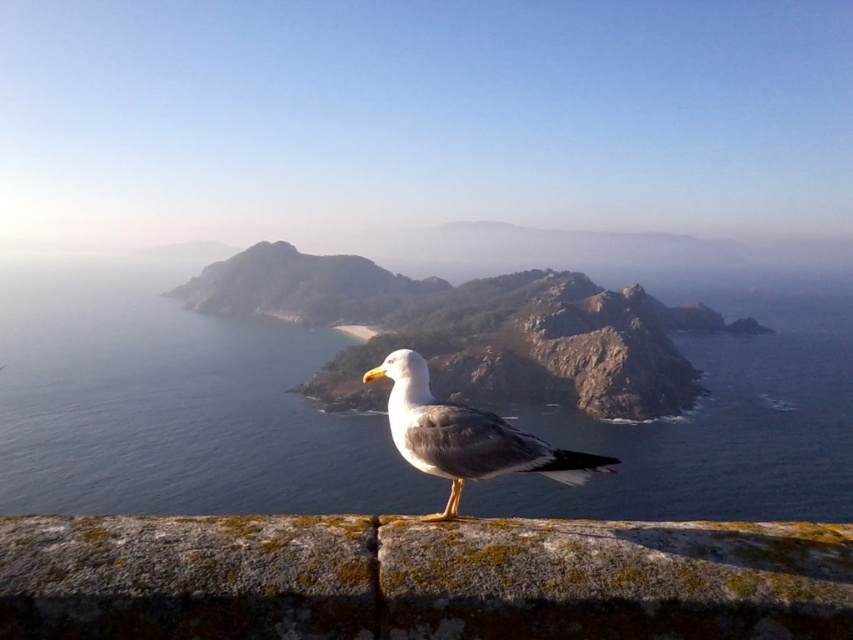
Can you confirm if blue water at center is taller than gray feathered seagull at center?

Correct, blue water at center is much taller as gray feathered seagull at center.

Between blue water at center and gray feathered seagull at center, which one appears on the left side from the viewer's perspective?

gray feathered seagull at center

Image resolution: width=853 pixels, height=640 pixels. What do you see at coordinates (173, 403) in the screenshot?
I see `blue water at center` at bounding box center [173, 403].

At what (x,y) coordinates should I click in order to perform the action: click on blue water at center. Please return your answer as a coordinate pair (x, y). Looking at the image, I should click on (173, 403).

This screenshot has height=640, width=853. In order to click on blue water at center in this screenshot , I will do `click(173, 403)`.

Can you confirm if blue water at center is thinner than mossy stone at center?

No, blue water at center is not thinner than mossy stone at center.

Who is more distant from viewer, (415, 483) or (138, 529)?

Positioned behind is point (415, 483).

Locate an element on the screen. blue water at center is located at coordinates (173, 403).

Is mossy stone at center shorter than gray feathered seagull at center?

Yes.

Who is more forward, (834,595) or (483,444)?

Point (834,595) is in front.

The height and width of the screenshot is (640, 853). What do you see at coordinates (419, 579) in the screenshot? I see `mossy stone at center` at bounding box center [419, 579].

Find the location of a particular element. The width and height of the screenshot is (853, 640). mossy stone at center is located at coordinates (419, 579).